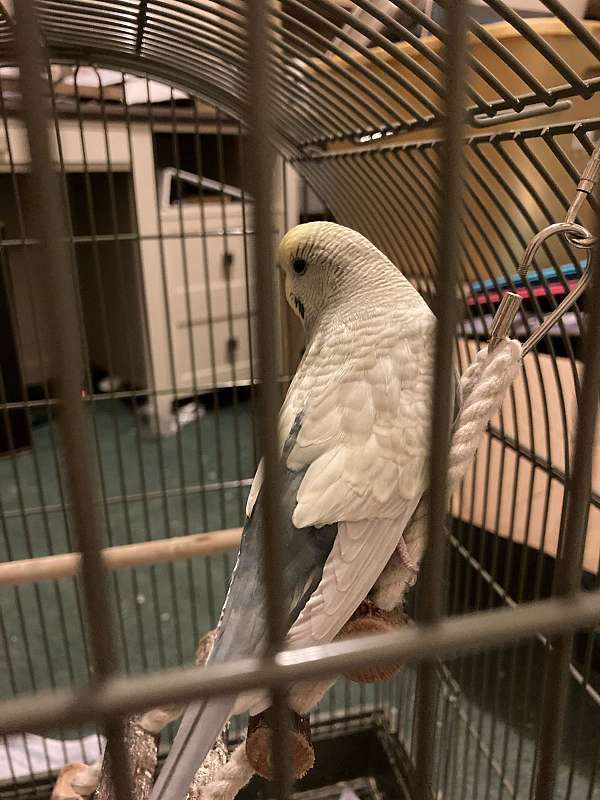
Identify the location of top drawer. The width and height of the screenshot is (600, 800). (186, 149).